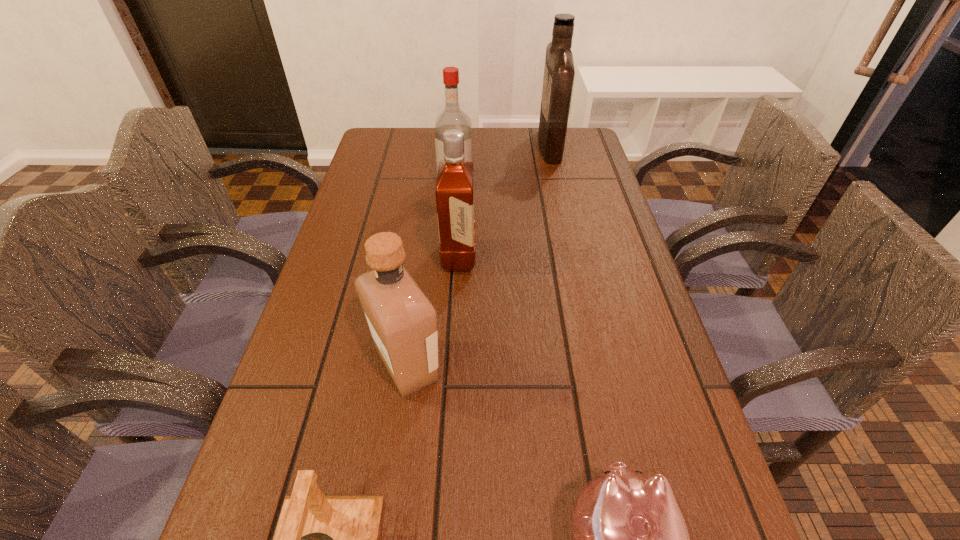
Choose which object is the second nearest neighbor to the bell. Please provide its 2D coordinates. Your answer should be formatted as a tuple, i.e. [(x, y)], where the tuple contains the x and y coordinates of a point satisfying the conditions above.

[(631, 538)]

Identify the location of the second closest object to the piggy bank. (319, 539).

Select which liquor appears as the closest to the nearest liquor. Please provide its 2D coordinates. Your answer should be formatted as a tuple, i.e. [(x, y)], where the tuple contains the x and y coordinates of a point satisfying the conditions above.

[(455, 181)]

The image size is (960, 540). What are the coordinates of `liquor that stands as the third closest to the farthest liquor` in the screenshot? It's located at (402, 321).

I want to click on blank area in the image that satisfies the following two spatial constraints: 1. on the label side of the tallest object; 2. on the front-facing side of the fifth nearest object, so click(558, 181).